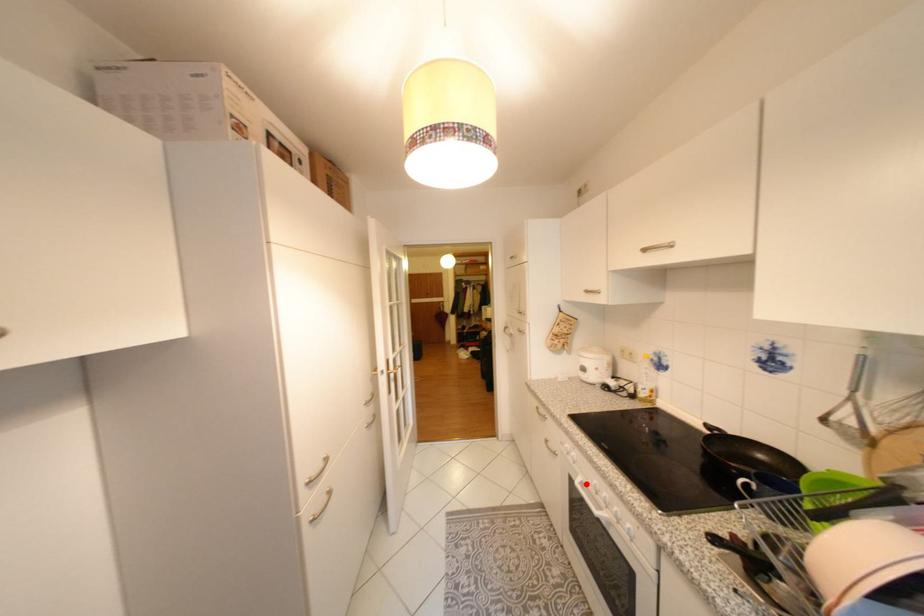
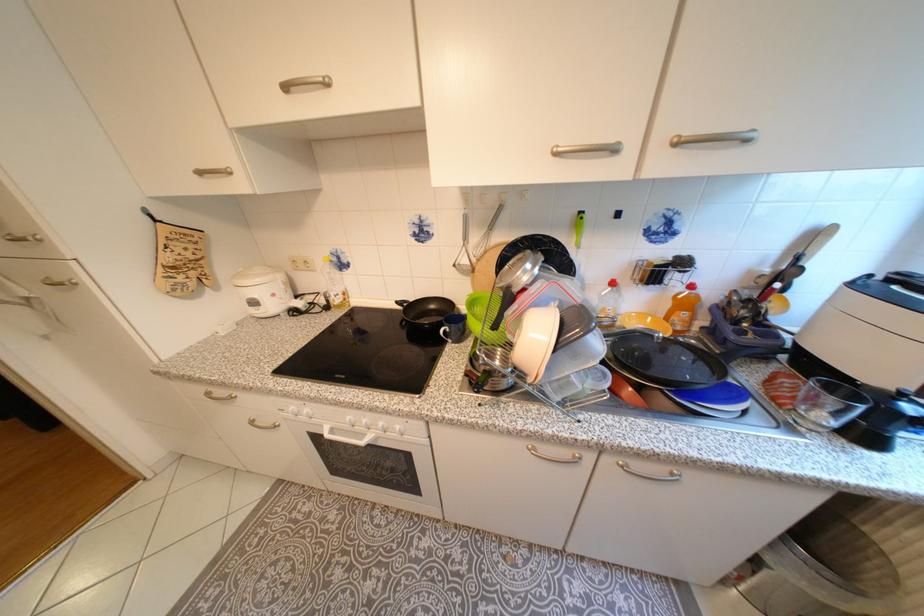
Find the pixel in the second image that matches the highlighted location in the first image.

(335, 436)